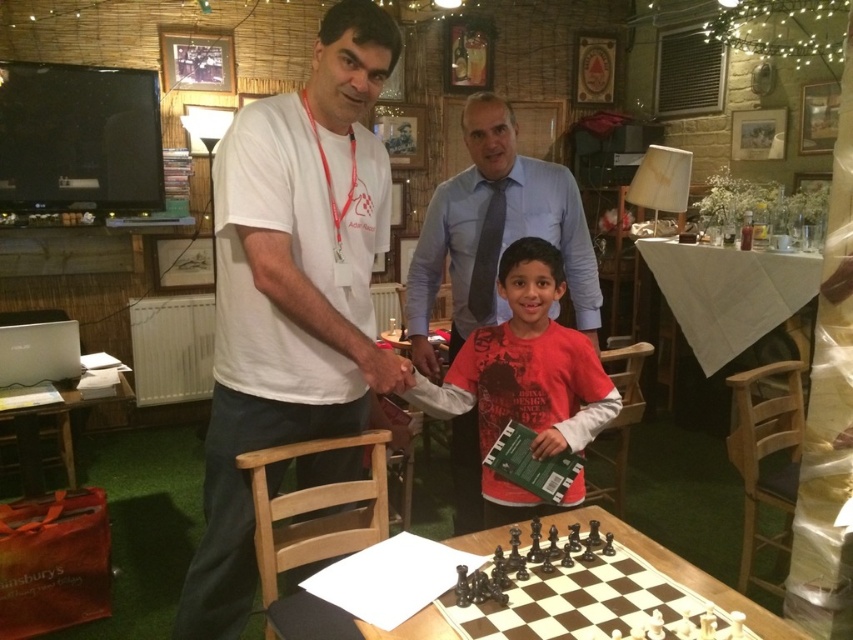
Question: Estimate the real-world distances between objects in this image. Which object is closer to the red cotton shirt at center?

Choices:
 (A) white cotton t-shirt at center
 (B) wooden chessboard at center

Answer: (B)

Question: Based on their relative distances, which object is nearer to the white cotton t-shirt at center?

Choices:
 (A) red cotton shirt at center
 (B) wooden table at lower left

Answer: (A)

Question: Is red cotton shirt at center to the right of white cloth-covered table at center from the viewer's perspective?

Choices:
 (A) no
 (B) yes

Answer: (A)

Question: Is white cotton t-shirt at center positioned behind white cloth-covered table at center?

Choices:
 (A) no
 (B) yes

Answer: (A)

Question: Can you confirm if red cotton shirt at center is positioned to the right of white cloth-covered table at center?

Choices:
 (A) no
 (B) yes

Answer: (A)

Question: Considering the real-world distances, which object is closest to the red cotton shirt at center?

Choices:
 (A) white cotton t-shirt at center
 (B) wooden table at lower left

Answer: (A)